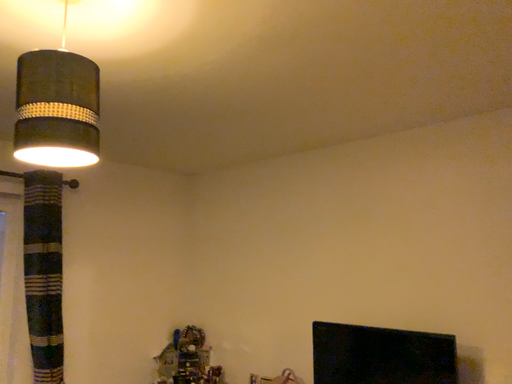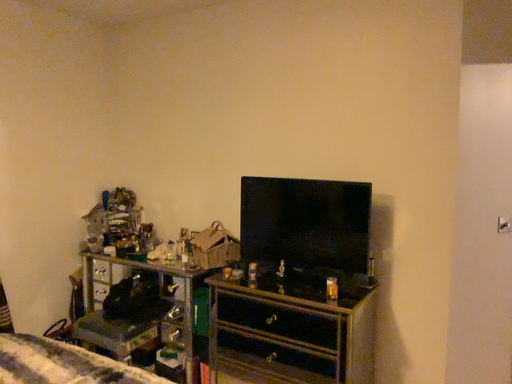
Question: Which way did the camera rotate in the video?

Choices:
 (A) rotated left
 (B) rotated right

Answer: (B)